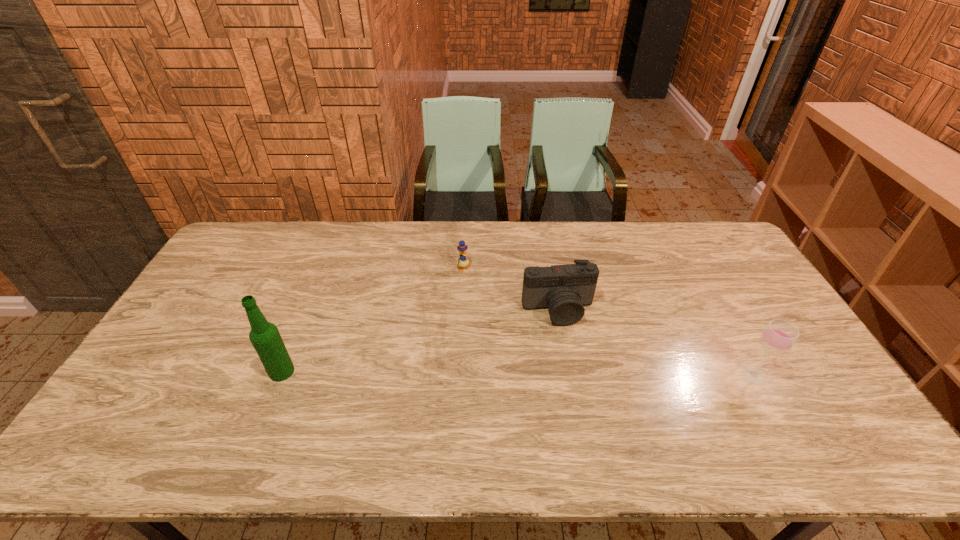
Where is `the tallest object`? the tallest object is located at coordinates (264, 336).

Where is `beer bottle`? This screenshot has height=540, width=960. beer bottle is located at coordinates (264, 336).

Find the location of a particular element. Image resolution: width=960 pixels, height=540 pixels. wineglass is located at coordinates (778, 337).

You are a GUI agent. You are given a task and a screenshot of the screen. Output one action in this format:
    pyautogui.click(x=<x>, y=<y>)
    Task: Click on the rightmost object
    
    Given the screenshot: What is the action you would take?
    pyautogui.click(x=778, y=337)

The height and width of the screenshot is (540, 960). I want to click on duckling, so click(x=462, y=248).

Where is `the shortest object`? the shortest object is located at coordinates (462, 248).

At what (x,y) coordinates should I click in order to perform the action: click on camera. Please return your answer as a coordinate pair (x, y). The image size is (960, 540). Looking at the image, I should click on (562, 289).

You are a GUI agent. You are given a task and a screenshot of the screen. Output one action in this format:
    pyautogui.click(x=<x>, y=<y>)
    Task: Click on the second shortest object
    
    Given the screenshot: What is the action you would take?
    pyautogui.click(x=562, y=289)

You are a GUI agent. You are given a task and a screenshot of the screen. Output one action in this format:
    pyautogui.click(x=<x>, y=<y>)
    Task: Click on the vacant area located on the label of the beer bottle
    The image size is (960, 540).
    Given the screenshot: What is the action you would take?
    pyautogui.click(x=171, y=372)

Locate an element on the screen. The image size is (960, 540). vacant space positioned on the label of the beer bottle is located at coordinates (153, 372).